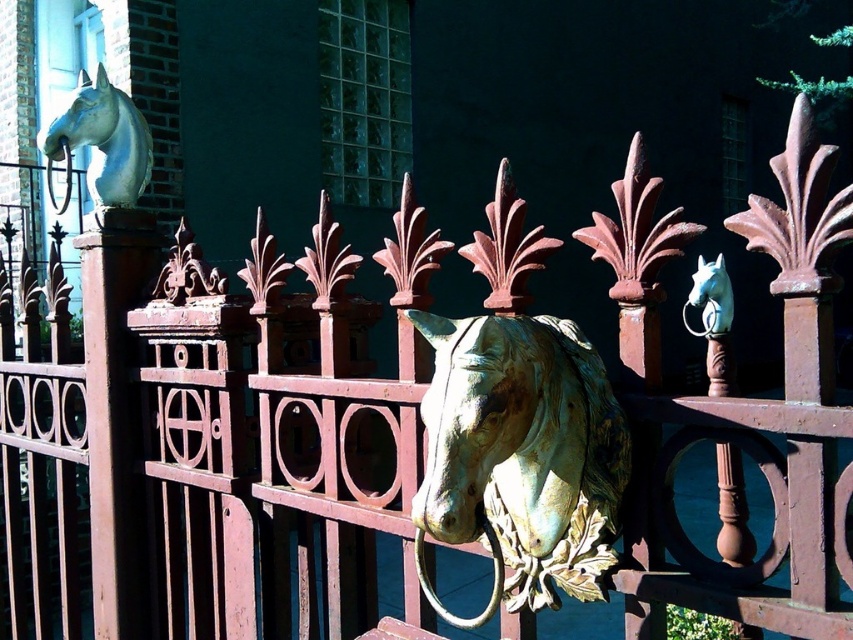
You are standing in front of a decorative metal fence with ornate horse heads. There is a point marked at coordinates (102, 141). Which object on the fence does this point correspond to?

The point at coordinates (102, 141) corresponds to the matte green horse head at upper left.